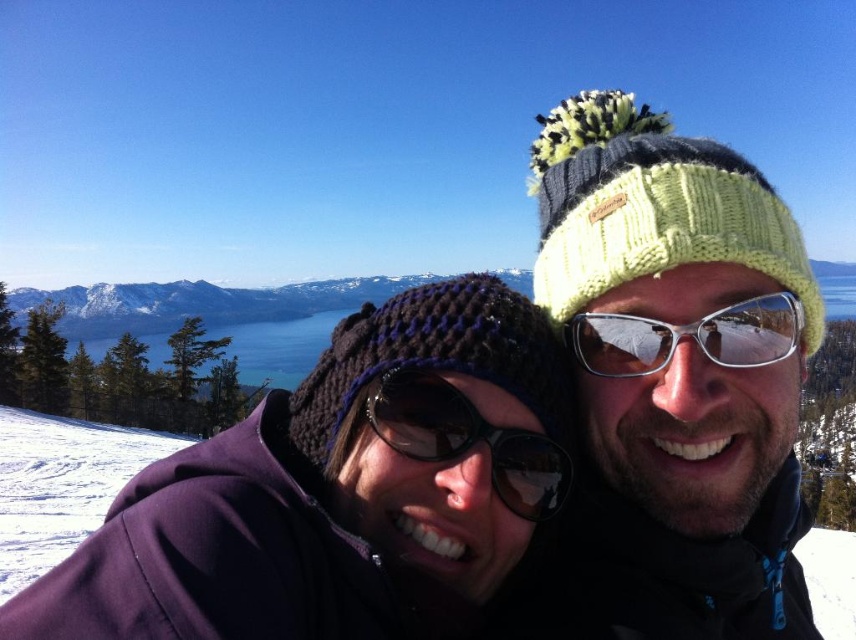
Is knitted yellow hat at center thinner than black reflective sunglasses at center?

No.

Is knitted yellow hat at center closer to camera compared to black reflective sunglasses at center?

Yes, knitted yellow hat at center is closer to the viewer.

This screenshot has height=640, width=856. In order to click on knitted yellow hat at center in this screenshot , I will do `click(678, 369)`.

Does purple knitted beanie at center have a smaller size compared to knitted yellow hat at center?

No.

Who is shorter, purple knitted beanie at center or knitted yellow hat at center?

purple knitted beanie at center

What do you see at coordinates (342, 492) in the screenshot? The width and height of the screenshot is (856, 640). I see `purple knitted beanie at center` at bounding box center [342, 492].

In order to click on purple knitted beanie at center in this screenshot , I will do coord(342,492).

Which is above, knitted yellow hat at center or silver reflective glasses at center?

knitted yellow hat at center is above.

Can you confirm if knitted yellow hat at center is smaller than silver reflective glasses at center?

No.

The width and height of the screenshot is (856, 640). What are the coordinates of `knitted yellow hat at center` in the screenshot? It's located at (678, 369).

At what (x,y) coordinates should I click in order to perform the action: click on knitted yellow hat at center. Please return your answer as a coordinate pair (x, y). This screenshot has width=856, height=640. Looking at the image, I should click on (678, 369).